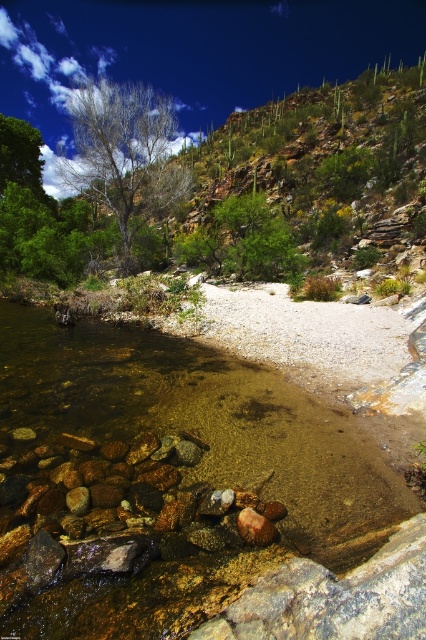
Question: Does translucent rock bed at lower left have a lesser width compared to green leafy tree at center?

Choices:
 (A) yes
 (B) no

Answer: (A)

Question: Does translucent rock bed at lower left lie behind green leafy tree at center?

Choices:
 (A) no
 (B) yes

Answer: (A)

Question: Among these objects, which one is nearest to the camera?

Choices:
 (A) translucent rock bed at lower left
 (B) green leafy tree at center

Answer: (A)

Question: Which of the following is the closest to the observer?

Choices:
 (A) (201, 586)
 (B) (161, 184)

Answer: (A)

Question: Can you confirm if translucent rock bed at lower left is bigger than green leafy tree at center?

Choices:
 (A) no
 (B) yes

Answer: (A)